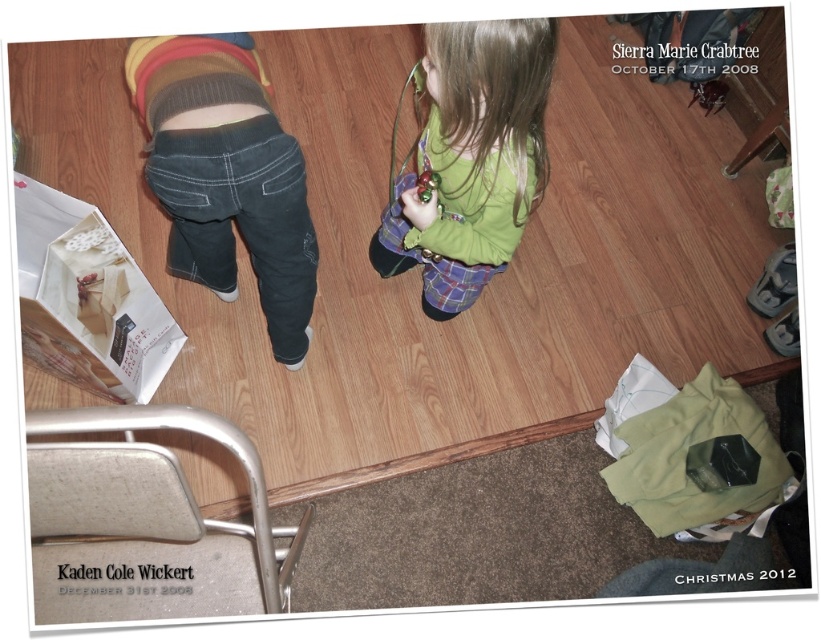
You are a delivery person who needs to place a small package on the green matte shirt at center and the white paper shopping bag at lower left. Which object should you place the package on to ensure it is visible from the front door, which is located at the lower right corner of the room?

The green matte shirt at center should be chosen because it is positioned above the white paper shopping bag at lower left, making it more visible from the front door at the lower right corner.

Based on the photo, based on the scene description, where is the denim jeans at center located in terms of coordinates?

The denim jeans at center is located at coordinates point (226, 176).